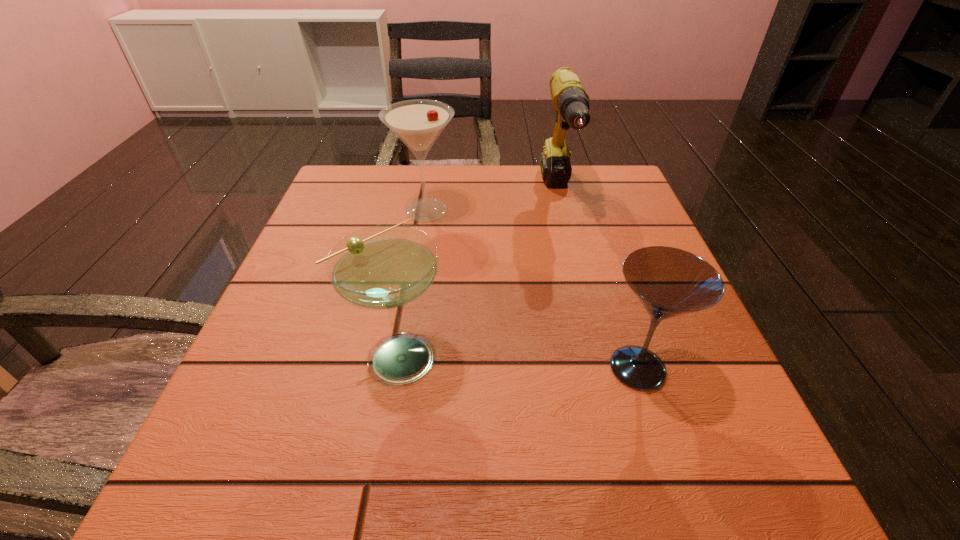
The width and height of the screenshot is (960, 540). I want to click on drill, so click(x=571, y=101).

Where is `the farthest martini`? This screenshot has height=540, width=960. the farthest martini is located at coordinates (418, 123).

Locate an element on the screen. the shortest object is located at coordinates (669, 282).

The height and width of the screenshot is (540, 960). What are the coordinates of `the rightmost martini` in the screenshot? It's located at (669, 282).

Find the location of a particular element. The image size is (960, 540). free region located on the handle side of the drill is located at coordinates (580, 281).

Find the location of a particular element. The image size is (960, 540). blank area located on the front of the farthest martini is located at coordinates (406, 333).

What are the coordinates of `vacant space located 0.320m on the back of the shortest martini` in the screenshot? It's located at (591, 224).

Locate an element on the screen. drill that is at the far edge is located at coordinates (571, 101).

What are the coordinates of `martini present at the far edge` in the screenshot? It's located at (418, 123).

The height and width of the screenshot is (540, 960). I want to click on drill situated at the right edge, so click(x=571, y=101).